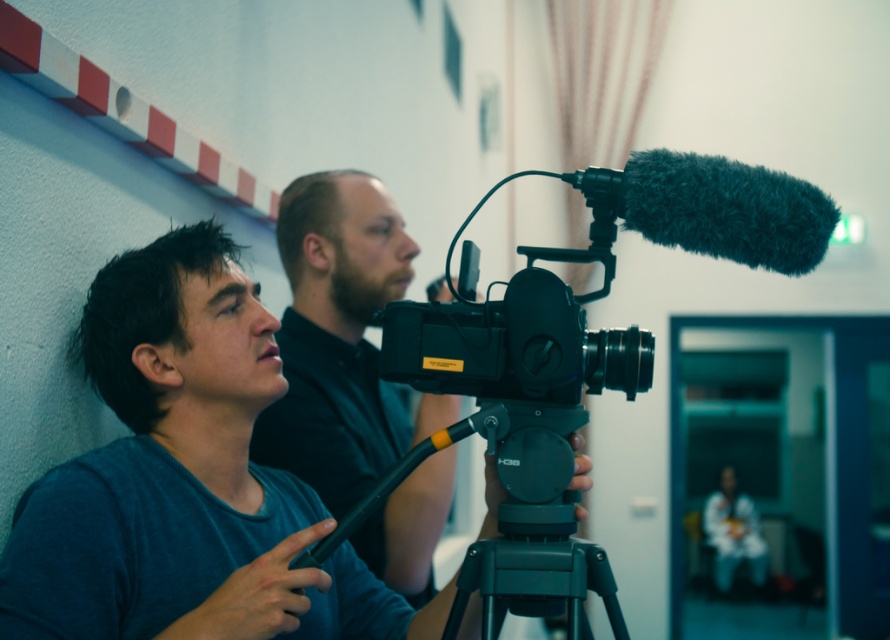
Does point (336, 564) come closer to viewer compared to point (783, 195)?

No.

Which is behind, point (158, 557) or point (515, 324)?

Point (158, 557)

Which is in front, point (227, 368) or point (530, 593)?

Point (530, 593)

This screenshot has width=890, height=640. What are the coordinates of `matte black camera at center` in the screenshot? It's located at (184, 477).

Does point (268, 396) come in front of point (448, 634)?

No.

Locate an element on the screen. The width and height of the screenshot is (890, 640). matte black camera at center is located at coordinates (184, 477).

Which is in front, point (308, 522) or point (731, 516)?

Point (308, 522)

Between matte black camera at center and white fabric at lower right, which one has more height?

white fabric at lower right

Between point (144, 624) and point (715, 536), which one is positioned in front?

Point (144, 624) is more forward.

This screenshot has height=640, width=890. Identify the location of matte black camera at center. (184, 477).